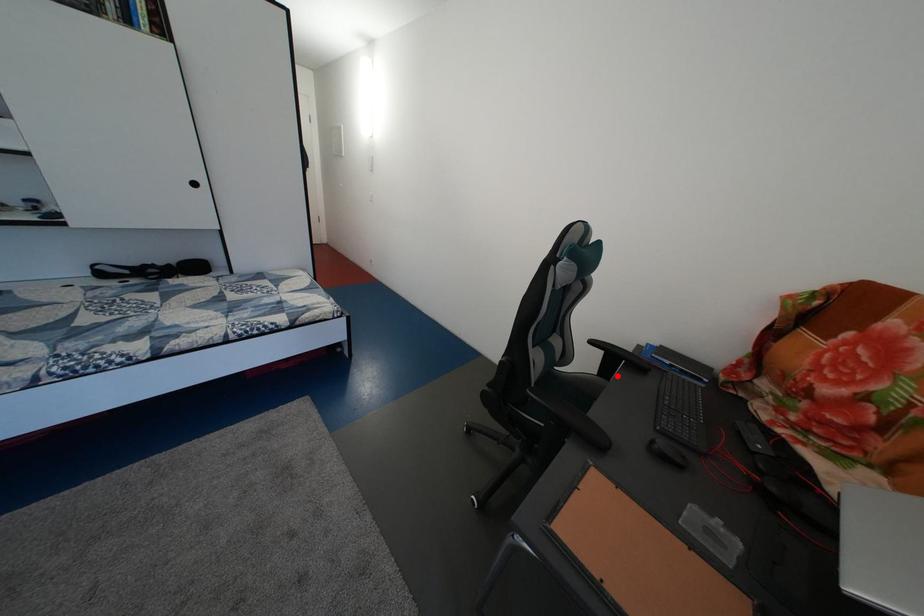
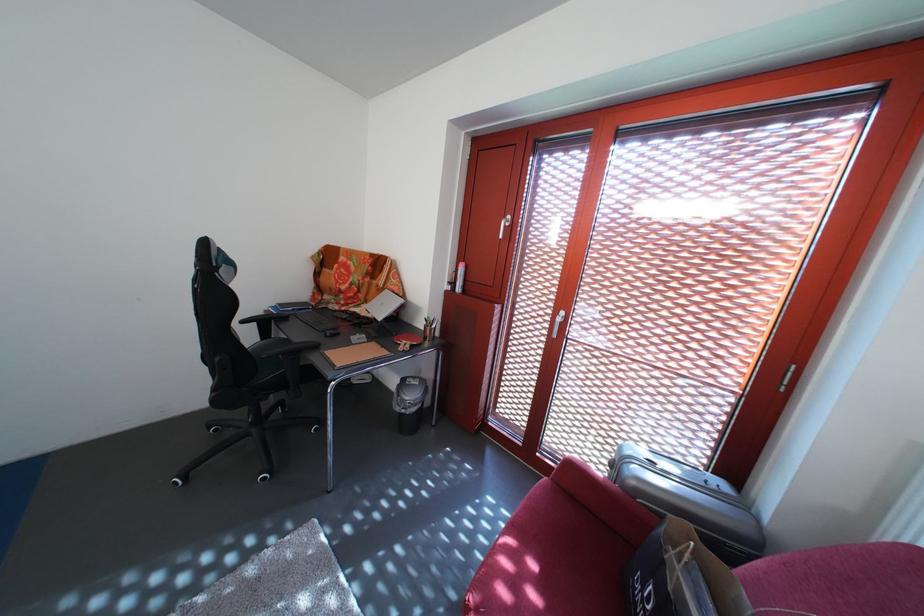
Question: I am providing you with two images of the same scene from different viewpoints. Given a red point in image1, look at the same physical point in image2. Is it:

Choices:
 (A) Closer to the viewpoint
 (B) Farther from the viewpoint

Answer: (B)